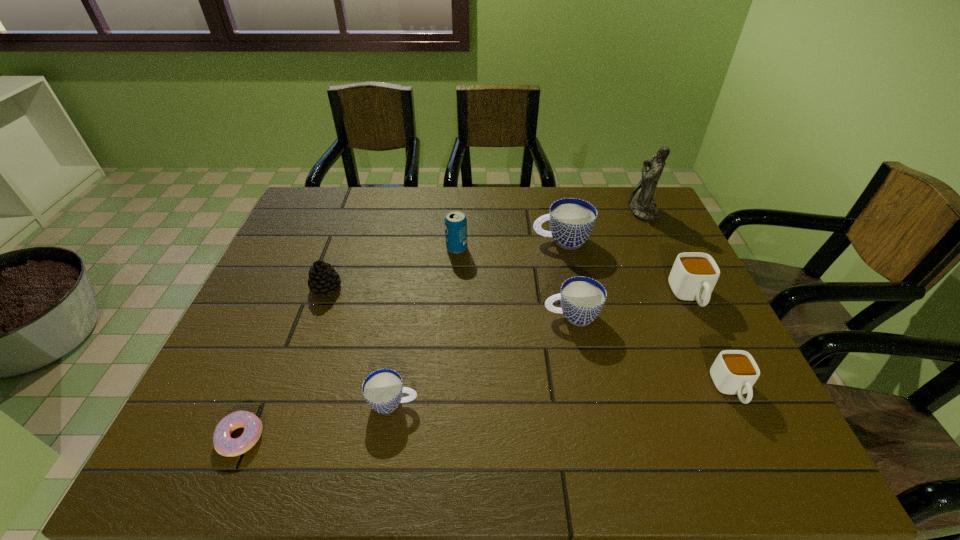
Identify the location of cup at the far edge. (572, 220).

In order to click on object located at the near edge in this screenshot , I will do `click(226, 446)`.

The image size is (960, 540). Find the location of `pinecone located in the left edge section of the desktop`. pinecone located in the left edge section of the desktop is located at coordinates (323, 278).

Where is `doughnut that is at the left edge`? This screenshot has width=960, height=540. doughnut that is at the left edge is located at coordinates (226, 446).

You are a GUI agent. You are given a task and a screenshot of the screen. Output one action in this format:
    pyautogui.click(x=<x>, y=<y>)
    Task: Click on the figurine present at the right edge
    This screenshot has height=540, width=960.
    Given the screenshot: What is the action you would take?
    pyautogui.click(x=641, y=203)

Where is `object situated at the near left corner`? object situated at the near left corner is located at coordinates (226, 446).

The image size is (960, 540). What are the coordinates of `object that is at the far right corner` in the screenshot? It's located at (641, 203).

Image resolution: width=960 pixels, height=540 pixels. In the image, there is a desktop. Identify the location of vacant space at the far edge. (417, 201).

This screenshot has height=540, width=960. What are the coordinates of `vacant space at the near edge` in the screenshot? It's located at (450, 430).

Where is `free region at the left edge of the desktop`? free region at the left edge of the desktop is located at coordinates (233, 396).